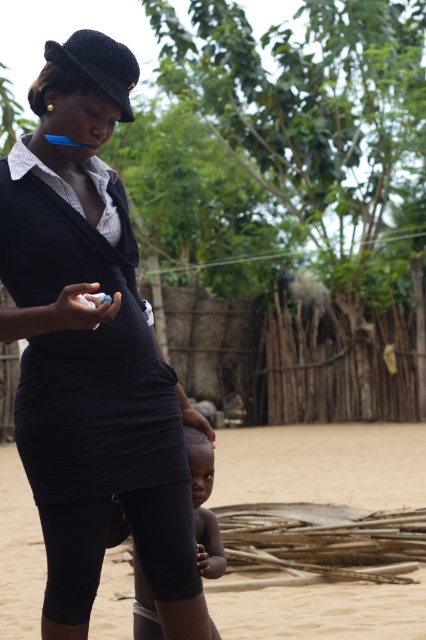
Question: Considering the relative positions of brown sandy dirt at center and dark skin baby at lower center in the image provided, where is brown sandy dirt at center located with respect to dark skin baby at lower center?

Choices:
 (A) right
 (B) left

Answer: (B)

Question: Does brown sandy dirt at center have a greater width compared to dark skin baby at lower center?

Choices:
 (A) yes
 (B) no

Answer: (A)

Question: Which point is closer to the camera taking this photo?

Choices:
 (A) (63, 157)
 (B) (11, 552)

Answer: (A)

Question: Among these objects, which one is farthest from the camera?

Choices:
 (A) brown sandy dirt at center
 (B) dark skin baby at lower center

Answer: (A)

Question: Does black matte dress at center appear on the left side of brown sandy dirt at center?

Choices:
 (A) yes
 (B) no

Answer: (B)

Question: Estimate the real-world distances between objects in this image. Which object is closer to the dark skin baby at lower center?

Choices:
 (A) brown sandy dirt at center
 (B) black matte dress at center

Answer: (B)